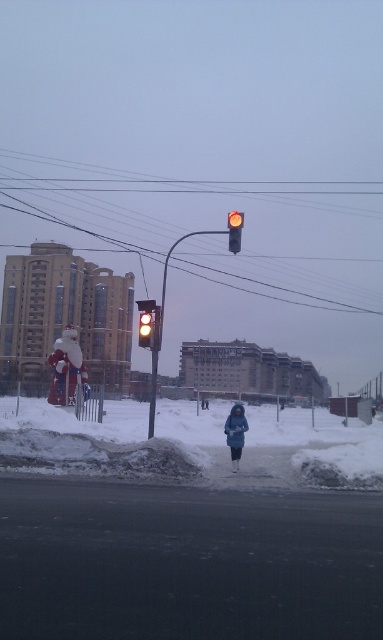
Question: Which of the following is the closest to the observer?

Choices:
 (A) (232, 460)
 (B) (140, 346)

Answer: (A)

Question: Which object is farther from the camera taking this photo?

Choices:
 (A) yellow glass traffic light at center
 (B) dark blue woolen coat at center

Answer: (A)

Question: Can you confirm if yellow glass traffic light at left is smaller than yellow matte traffic light at upper center?

Choices:
 (A) no
 (B) yes

Answer: (B)

Question: Which of these objects is positioned farthest from the white powdery snow at lower center?

Choices:
 (A) yellow glass traffic light at left
 (B) yellow matte traffic light at upper center

Answer: (B)

Question: Is white powdery snow at lower center in front of yellow matte traffic light at upper center?

Choices:
 (A) yes
 (B) no

Answer: (A)

Question: Is yellow matte traffic light at upper center to the left of yellow glass traffic light at center from the viewer's perspective?

Choices:
 (A) yes
 (B) no

Answer: (B)